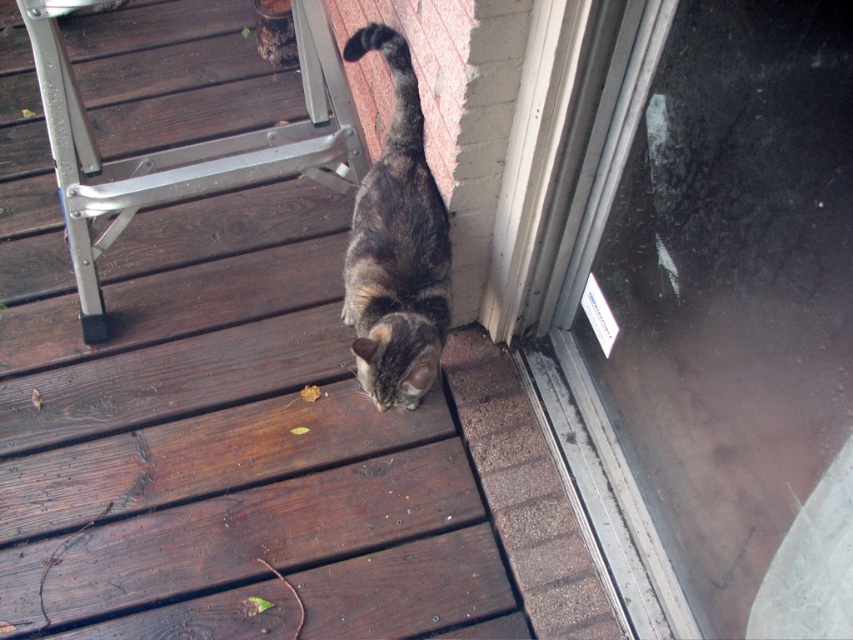
Identify the location of brown wooden deck at center. (213, 428).

How much distance is there between brown wooden deck at center and tabby fur cat at lower center?

brown wooden deck at center and tabby fur cat at lower center are 12.42 inches apart from each other.

Does point (431, 432) come in front of point (366, 304)?

No, it is not.

Locate an element on the screen. The height and width of the screenshot is (640, 853). brown wooden deck at center is located at coordinates pos(213,428).

Does point (628, 276) come in front of point (397, 51)?

Yes, point (628, 276) is in front of point (397, 51).

How distant is transparent glass door at lower right from tabby fur cat at lower center?

transparent glass door at lower right is 13.16 inches away from tabby fur cat at lower center.

Is point (614, 236) positioned in front of point (376, 385)?

That is True.

Where is `transparent glass door at lower right`? transparent glass door at lower right is located at coordinates coord(712,320).

From the picture: Does brown wooden deck at center have a larger size compared to transparent glass door at lower right?

Yes.

Looking at this image, which is more to the right, brown wooden deck at center or transparent glass door at lower right?

transparent glass door at lower right

I want to click on brown wooden deck at center, so click(213, 428).